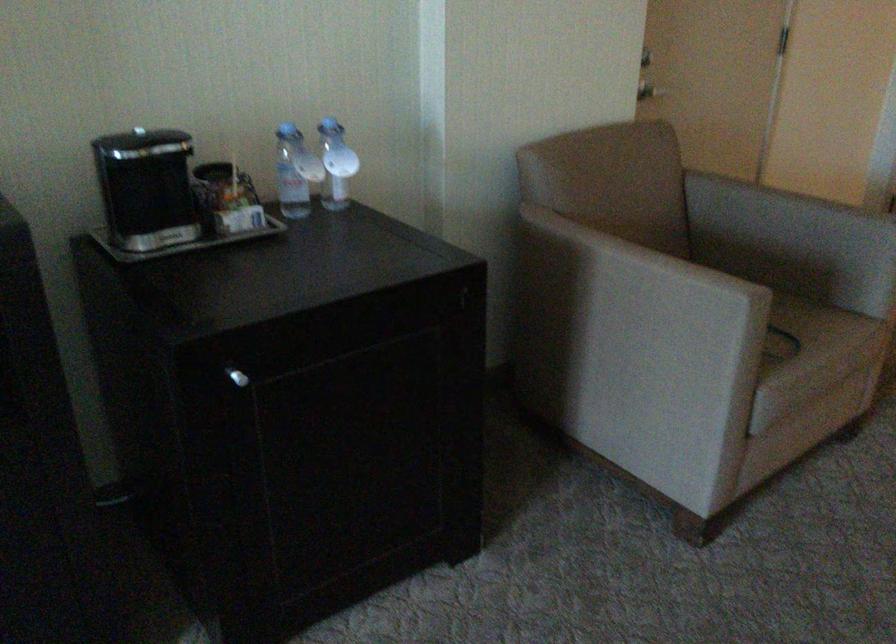
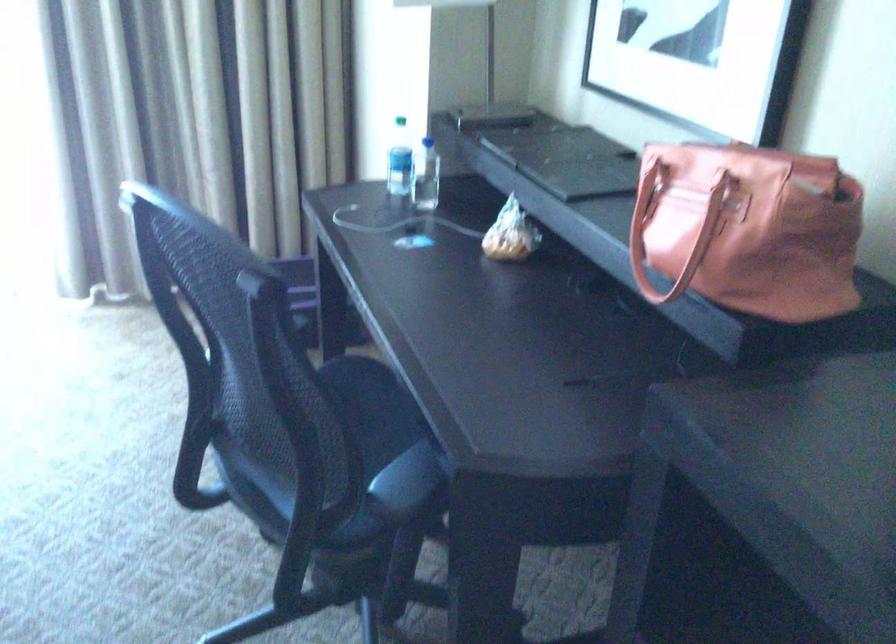
The images are taken continuously from a first-person perspective. In which direction is your viewpoint rotating?

The rotation direction of the camera is left-down.